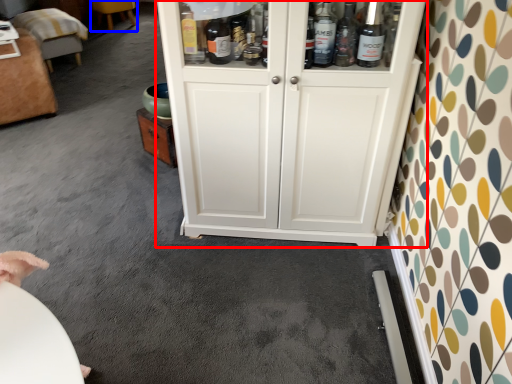
Question: Which object is further to the camera taking this photo, cupboard (highlighted by a red box) or furniture (highlighted by a blue box)?

Choices:
 (A) cupboard
 (B) furniture

Answer: (B)